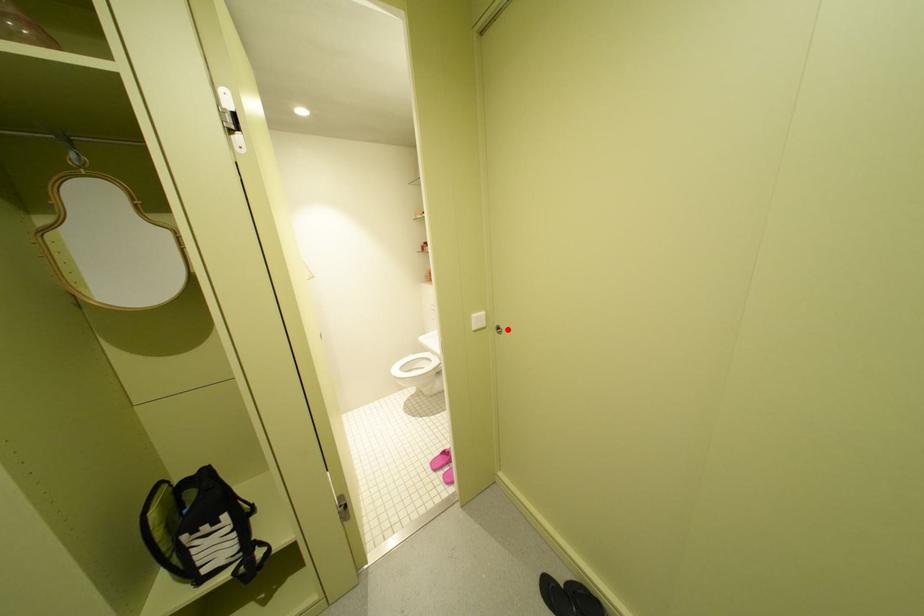
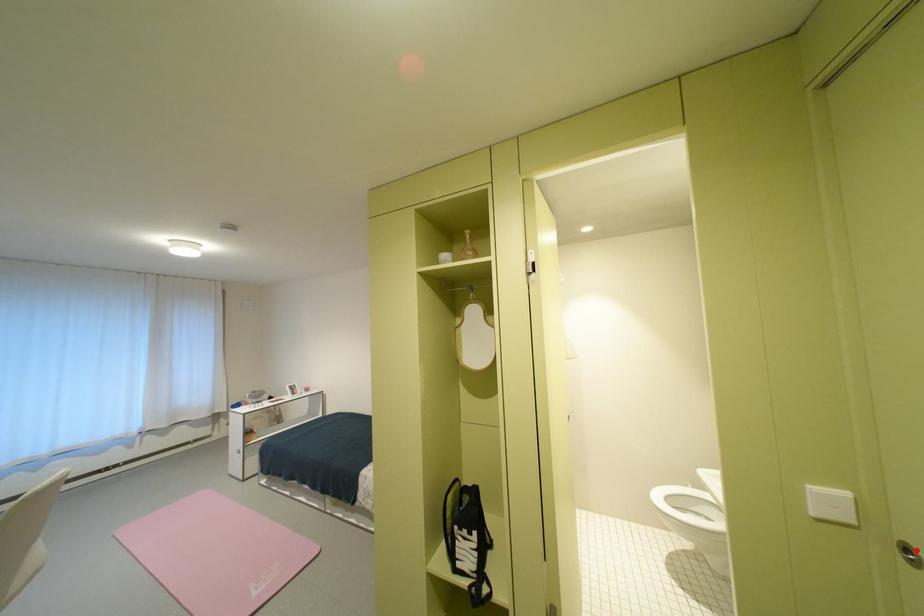
I am providing you with two images of the same scene from different viewpoints. A red point is marked on the first image and another point is marked on the second image. Do the highlighted points in image1 and image2 indicate the same real-world spot?

Yes